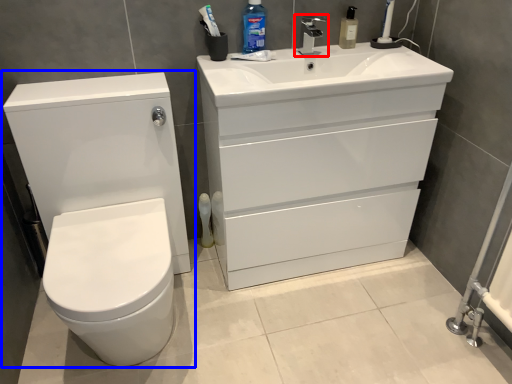
Question: Which object is further to the camera taking this photo, tap (highlighted by a red box) or toilet (highlighted by a blue box)?

Choices:
 (A) tap
 (B) toilet

Answer: (A)